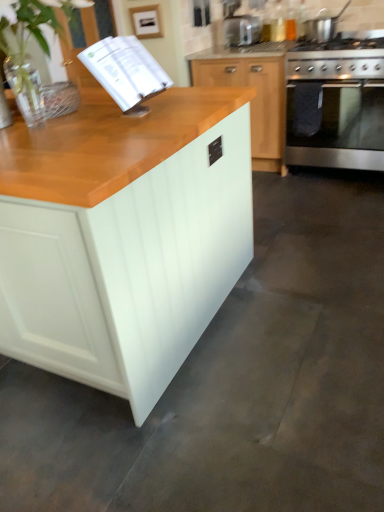
What are the coordinates of `vacant space that is in between white paper book at upper left and green leafy plant at upper left` in the screenshot? It's located at (96, 133).